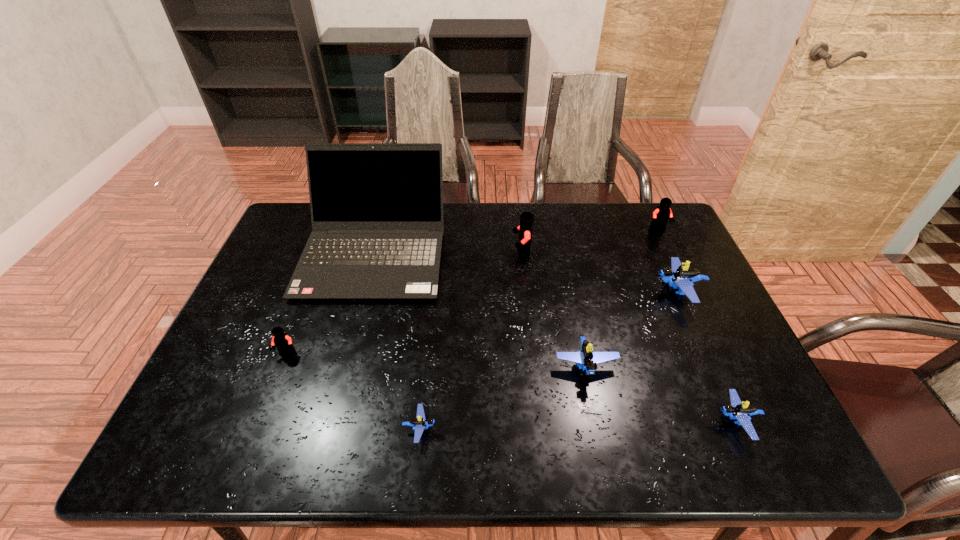
Identify the location of laptop computer that is at the far edge. The width and height of the screenshot is (960, 540). (376, 208).

Identify the location of laptop computer at the left edge. 376,208.

The image size is (960, 540). Find the location of `Lego situated at the left edge`. Lego situated at the left edge is located at coordinates (283, 342).

Where is `object present at the far left corner`? The width and height of the screenshot is (960, 540). object present at the far left corner is located at coordinates point(376,208).

This screenshot has height=540, width=960. Find the location of `object located at the far right corner`. object located at the far right corner is located at coordinates (661, 215).

Identify the location of object positioned at the near right corner. The height and width of the screenshot is (540, 960). (736, 410).

Where is `vacant space at the far edge of the desktop`? Image resolution: width=960 pixels, height=540 pixels. vacant space at the far edge of the desktop is located at coordinates (540, 220).

In the image, there is a desktop. Identify the location of vacant space at the near edge. Image resolution: width=960 pixels, height=540 pixels. [x=612, y=435].

The height and width of the screenshot is (540, 960). Find the location of `vacant space at the left edge of the desktop`. vacant space at the left edge of the desktop is located at coordinates (291, 274).

The image size is (960, 540). In the image, there is a desktop. Find the location of `free region at the right edge`. free region at the right edge is located at coordinates (705, 319).